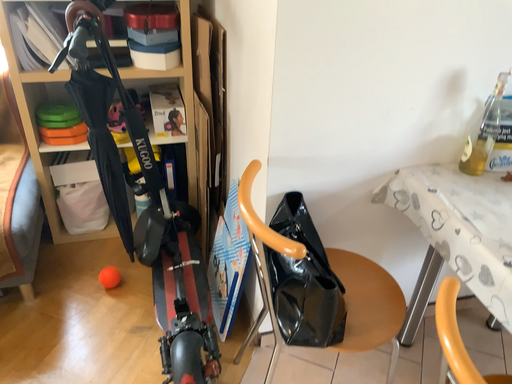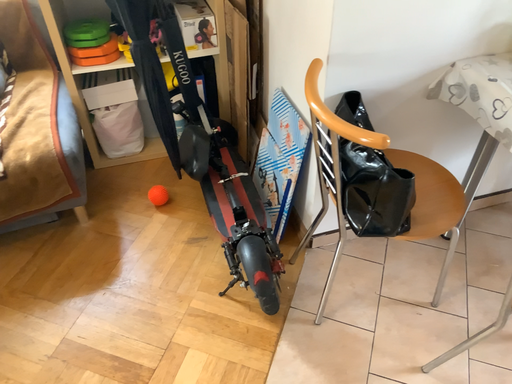
Question: How did the camera likely rotate when shooting the video?

Choices:
 (A) rotated downward
 (B) rotated upward

Answer: (A)